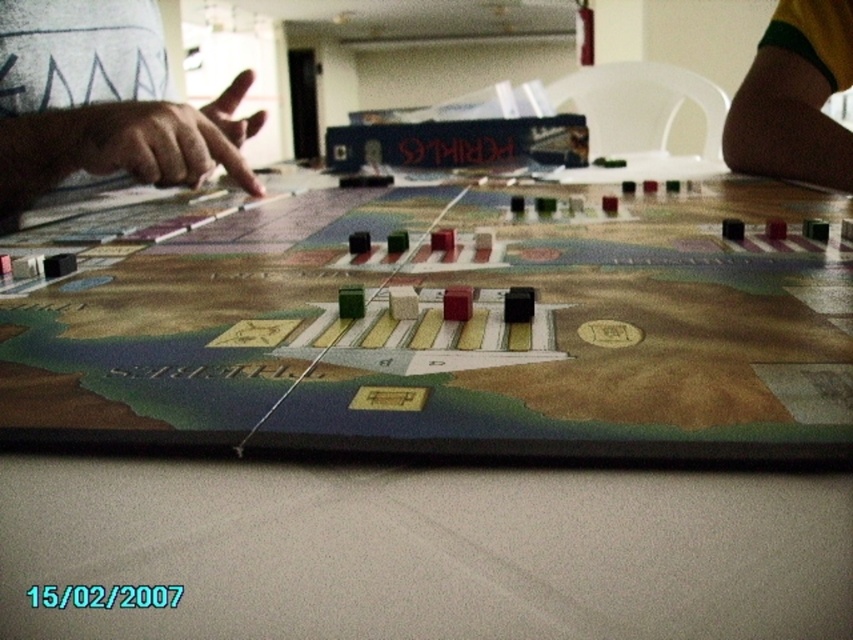
Question: Does skinny white hand at upper left appear over brown fabric pants at lower right?

Choices:
 (A) no
 (B) yes

Answer: (A)

Question: Can you confirm if skinny white hand at upper left is positioned below brown fabric pants at lower right?

Choices:
 (A) yes
 (B) no

Answer: (A)

Question: Can you confirm if skinny white hand at upper left is wider than brown fabric pants at lower right?

Choices:
 (A) yes
 (B) no

Answer: (A)